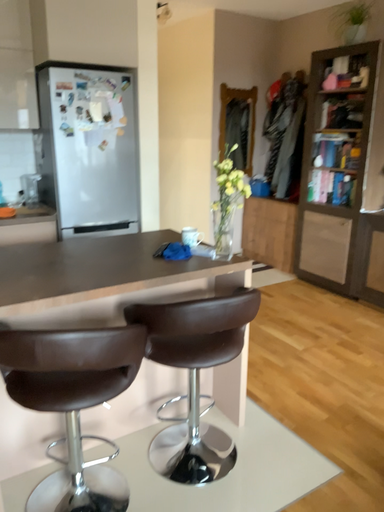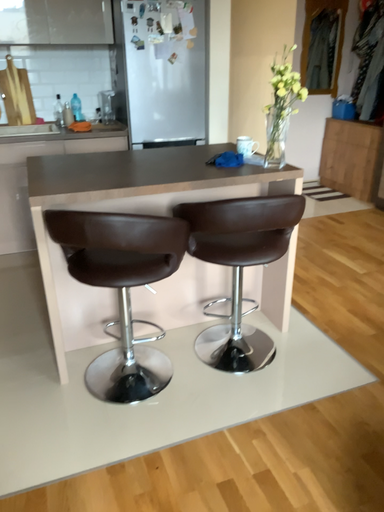
Question: Which way did the camera rotate in the video?

Choices:
 (A) rotated right
 (B) rotated left

Answer: (B)